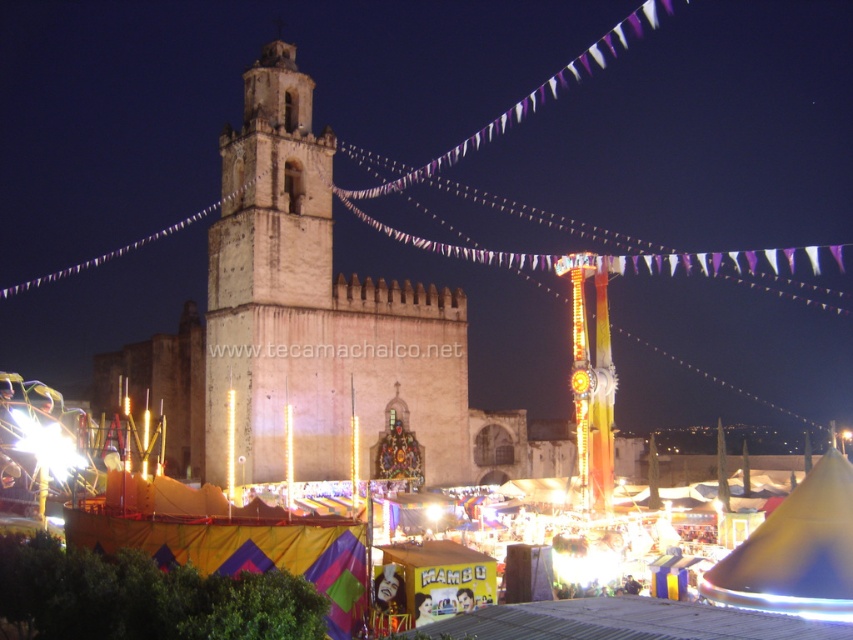
You are standing at the entrance of the fair and see the light brown stone tower at center and the multicolored fabric tent at center. Which object is closer to you?

The light brown stone tower at center is closer to you than the multicolored fabric tent at center.

You are standing at the center of the fairground and see the point marked at coordinates point (314, 316). Which object is this point located on?

The point (314, 316) is located on the light brown stone tower at center.

You are standing in the middle of the fairground and want to take a photo of both the light brown stone tower at center and the multicolored fabric tent at center. Which direction should you face to have both in your camera frame?

You should face to the left so that the light brown stone tower at center, which is to the right of the multicolored fabric tent at center, will be included in your photo.